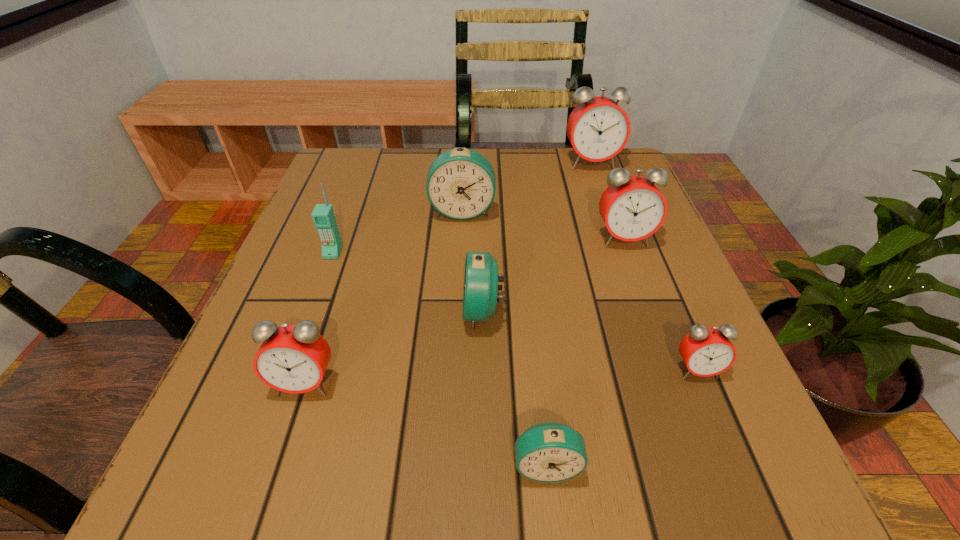
At what (x,y) coordinates should I click in order to perform the action: click on free region located on the front-facing side of the fourth farthest alarm clock. Please return your answer as a coordinate pair (x, y). The image size is (960, 540). Looking at the image, I should click on (354, 311).

You are a GUI agent. You are given a task and a screenshot of the screen. Output one action in this format:
    pyautogui.click(x=<x>, y=<y>)
    Task: Click on the vacant area situated 0.080m on the front-facing side of the leftmost red alarm clock
    
    Given the screenshot: What is the action you would take?
    pyautogui.click(x=281, y=457)

Where is `free region located 0.120m on the front-facing side of the smallest red alarm clock`? Image resolution: width=960 pixels, height=540 pixels. free region located 0.120m on the front-facing side of the smallest red alarm clock is located at coordinates (736, 465).

Locate an element on the screen. object that is at the near edge is located at coordinates (550, 452).

Locate an element on the screen. Image resolution: width=960 pixels, height=540 pixels. cellular telephone at the left edge is located at coordinates (323, 216).

This screenshot has width=960, height=540. What are the coordinates of `alarm clock positioned at the left edge` in the screenshot? It's located at (292, 358).

Where is `object that is at the far right corner`? object that is at the far right corner is located at coordinates (598, 128).

This screenshot has height=540, width=960. Find the location of `free space at the far edge of the desktop`. free space at the far edge of the desktop is located at coordinates (521, 166).

This screenshot has width=960, height=540. What are the coordinates of `vacant area at the near edge of the desktop` in the screenshot? It's located at (346, 461).

In the image, there is a desktop. Identify the location of vacant area at the left edge. (352, 308).